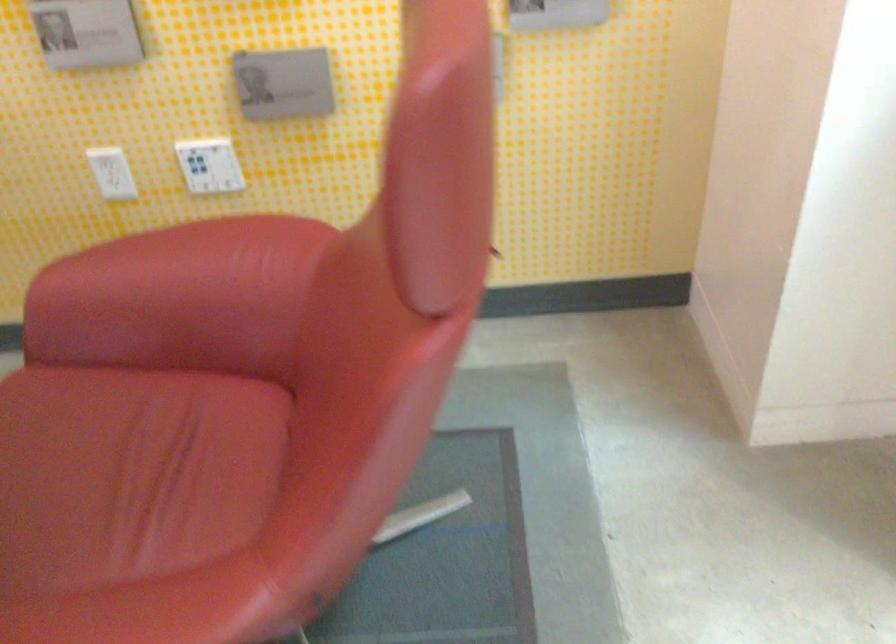
How did the camera likely rotate?

The camera's rotation is toward right-down.